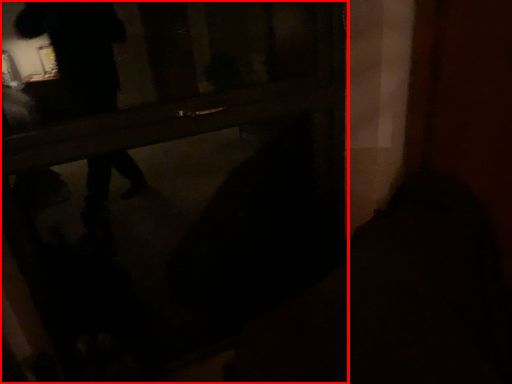
Question: From the image's perspective, considering the relative positions of door (annotated by the red box) and dark in the image provided, where is door (annotated by the red box) located with respect to the staircase?

Choices:
 (A) below
 (B) above

Answer: (B)